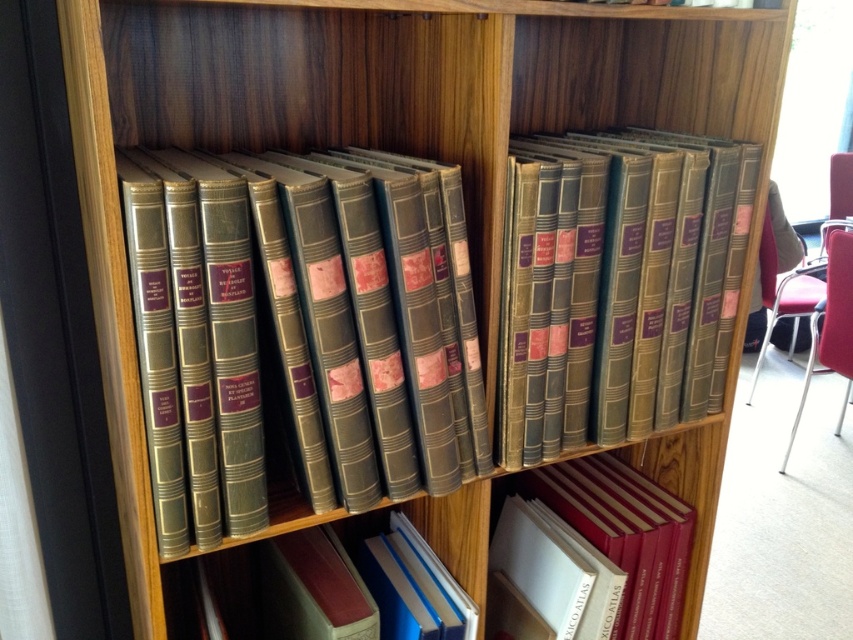
You are standing in front of the wooden bookshelf and want to reach the matte leather book at center. Considering your arm can extend 70 centimeters, can you reach it?

The matte leather book at center is 73.11 centimeters from the viewer, which is slightly beyond the arm extension of 70 centimeters, so you cannot reach it.

You are standing in front of the wooden bookshelf and want to reach both the matte leather book at center and the hardcover book at center. Which book should you move first to access the other?

You should move the matte leather book at center first because it is closer to you than the hardcover book at center, so accessing it requires less effort.